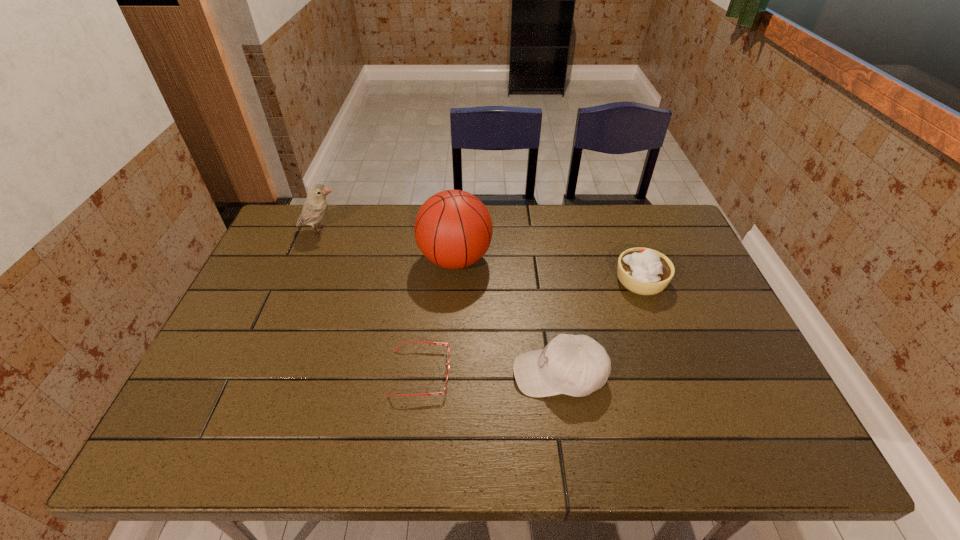
This screenshot has width=960, height=540. I want to click on vacant area that lies between the leftmost object and the tallest object, so click(x=388, y=245).

The image size is (960, 540). I want to click on the closest object to the whipped cream, so click(576, 365).

Identify the location of the third closest object to the shortest object. (644, 271).

You are a GUI agent. You are given a task and a screenshot of the screen. Output one action in this format:
    pyautogui.click(x=<x>, y=<y>)
    Task: Click on the vacant space that satisfies the following two spatial constraints: 1. at the face of the bird; 2. on the right side of the tallest object
    This screenshot has width=960, height=540.
    Given the screenshot: What is the action you would take?
    pyautogui.click(x=308, y=259)

The height and width of the screenshot is (540, 960). I want to click on free location that satisfies the following two spatial constraints: 1. on the back side of the rightmost object; 2. at the face of the leftmost object, so click(622, 230).

Where is `free space that satisfies the following two spatial constraints: 1. at the face of the tallest object; 2. on the right side of the second tallest object`? free space that satisfies the following two spatial constraints: 1. at the face of the tallest object; 2. on the right side of the second tallest object is located at coordinates (308, 259).